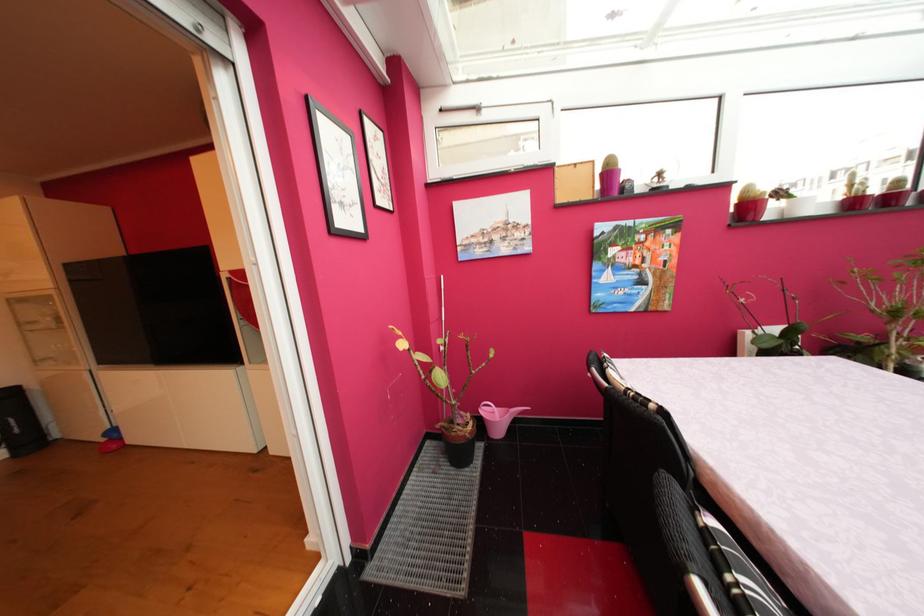
Where would you pull the white window handle? Please return your answer as a coordinate pair (x, y).

(490, 106)